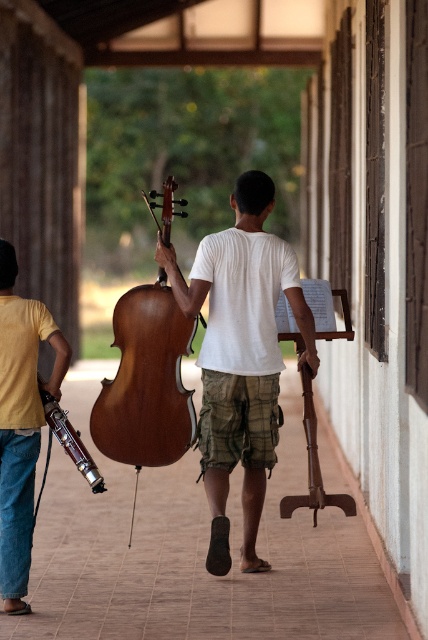
Is yellow cotton shirt at left smaller than wooden violin at center?

No.

Does yellow cotton shirt at left appear over wooden violin at center?

Yes.

The width and height of the screenshot is (428, 640). Describe the element at coordinates (20, 422) in the screenshot. I see `yellow cotton shirt at left` at that location.

Find the location of a particular element. The image size is (428, 640). yellow cotton shirt at left is located at coordinates (20, 422).

Which is more to the left, wooden cello at center or shiny brown cello at center?

From the viewer's perspective, shiny brown cello at center appears more on the left side.

Where is `wooden cello at center`? wooden cello at center is located at coordinates (240, 356).

Identify the location of wooden cello at center. The height and width of the screenshot is (640, 428). (240, 356).

Locate an element on the screen. The height and width of the screenshot is (640, 428). wooden cello at center is located at coordinates 240,356.

Between point (219, 364) and point (83, 470), which one is positioned in front?

Point (83, 470) is in front.

Does point (217, 396) come behind point (55, 400)?

Yes, point (217, 396) is farther from viewer.

Is point (275, 376) behind point (94, 476)?

Yes, it is behind point (94, 476).

Find the location of a particular element. The width and height of the screenshot is (428, 640). wooden cello at center is located at coordinates [x=240, y=356].